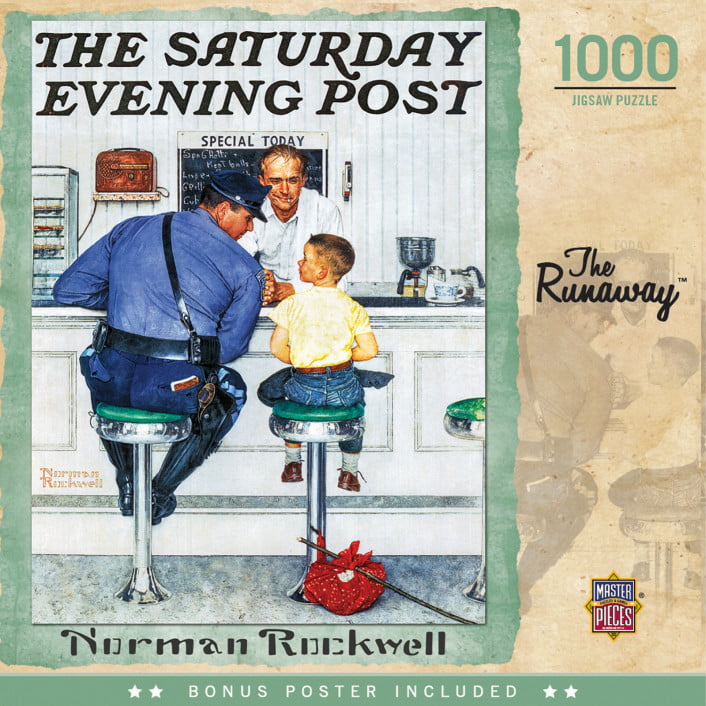
Where is `poster`? poster is located at coordinates (341, 690).